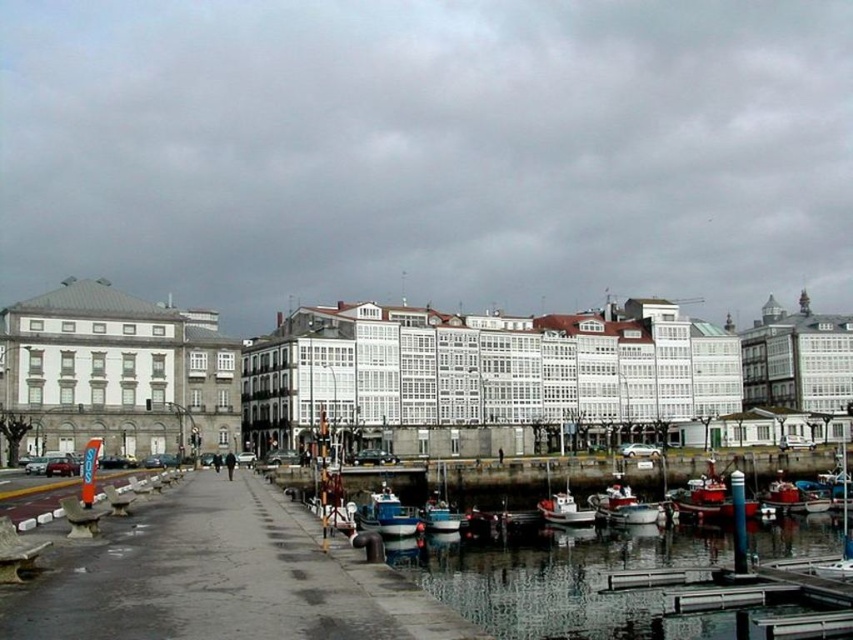
Is blue painted wooden boat at lower center shorter than metallic blue boat at lower center?

Yes.

From the picture: Who is more distant from viewer, (410, 532) or (637, 506)?

The point (637, 506) is more distant.

Who is more distant from viewer, (379, 492) or (631, 500)?

The point (379, 492) is behind.

You are a GUI agent. You are given a task and a screenshot of the screen. Output one action in this format:
    pyautogui.click(x=<x>, y=<y>)
    Task: Click on the blue painted wooden boat at lower center
    Image resolution: width=853 pixels, height=640 pixels.
    Given the screenshot: What is the action you would take?
    pyautogui.click(x=386, y=515)

Does blue painted wooden boat at lower center have a smaller size compared to white plastic boat at center?

Incorrect, blue painted wooden boat at lower center is not smaller in size than white plastic boat at center.

Who is more forward, (387, 509) or (567, 513)?

Point (387, 509)

The width and height of the screenshot is (853, 640). I want to click on blue painted wooden boat at lower center, so click(386, 515).

Does point (569, 625) come in front of point (457, 522)?

Yes.

Can you confirm if smooth glass water at lower right is thinner than blue wooden boat at center?

In fact, smooth glass water at lower right might be wider than blue wooden boat at center.

Where is `smooth glass water at lower right`? smooth glass water at lower right is located at coordinates (563, 580).